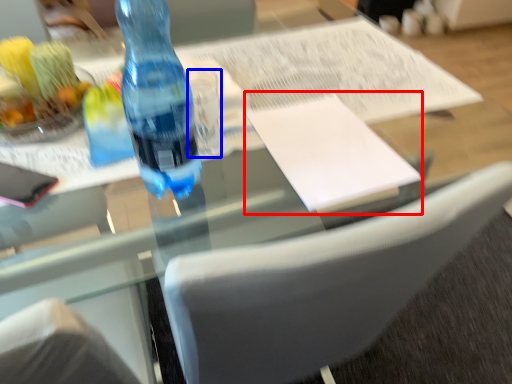
Question: Which object appears closest to the camera in this image, journal (highlighted by a red box) or clear (highlighted by a blue box)?

Choices:
 (A) journal
 (B) clear

Answer: (A)